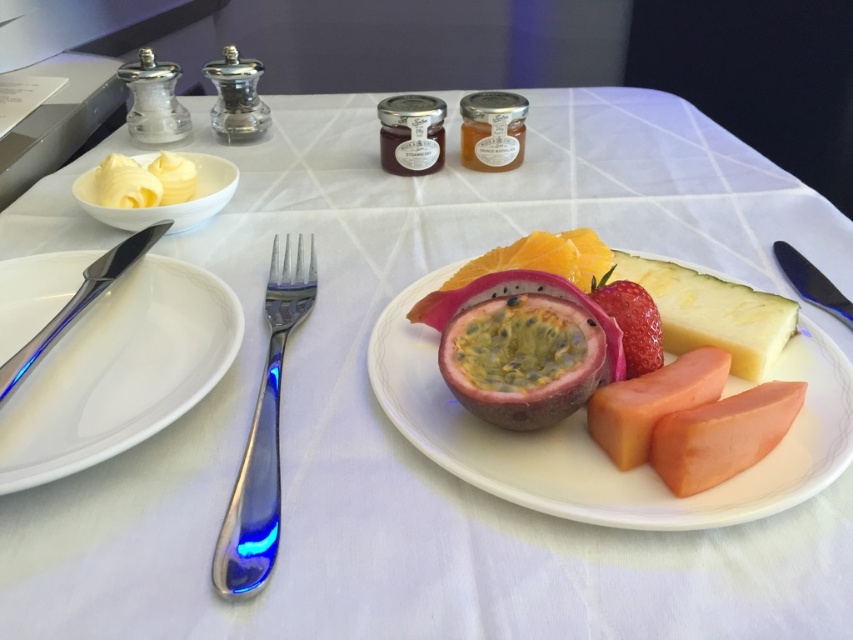
Question: Based on their relative distances, which object is farther from the white glossy plate at left?

Choices:
 (A) yellowish hard cheese at center-right
 (B) orange fleshed at center
 (C) satin silver knife at left
 (D) yellow butter at upper left

Answer: (A)

Question: Can you confirm if white glossy plate at left is positioned to the left of white matte butter at upper left?

Choices:
 (A) no
 (B) yes

Answer: (A)

Question: Which of the following is the closest to the observer?

Choices:
 (A) (573, 483)
 (B) (755, 330)

Answer: (A)

Question: Which of these objects is positioned closest to the white glossy plate at left?

Choices:
 (A) yellowish hard cheese at center-right
 (B) orange fleshed at center
 (C) silvermetallicknife at right
 (D) white matte butter at upper left

Answer: (D)

Question: Is smooth white plate at center wider than polished silver fork at left?

Choices:
 (A) no
 (B) yes

Answer: (B)

Question: Is white glossy plate at left smaller than white matte butter at upper left?

Choices:
 (A) yes
 (B) no

Answer: (B)